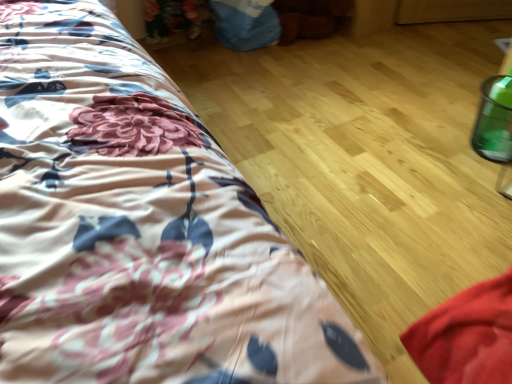
What do you see at coordinates (494, 121) in the screenshot?
I see `teal glass at right` at bounding box center [494, 121].

Identify the location of teal glass at right. (494, 121).

Where is `teal glass at right`? teal glass at right is located at coordinates (494, 121).